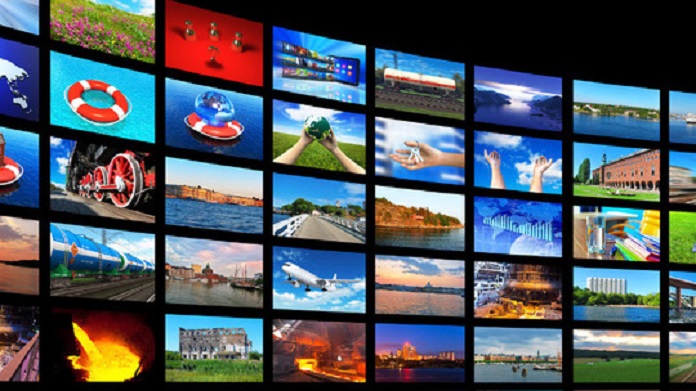
I want to click on 3rd row of pictures from the top, so click(22, 177), click(102, 193), click(211, 203), click(319, 212), click(406, 215), click(493, 228), click(616, 234), click(680, 232).